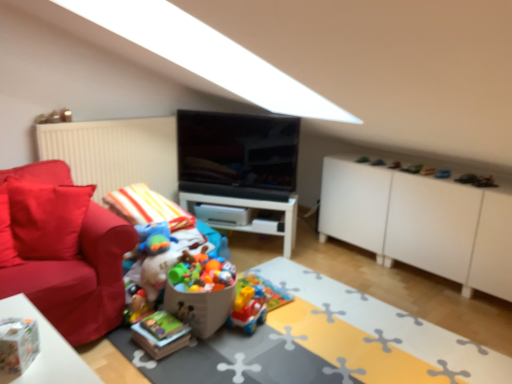
What is the approximate width of matte red couch at left?

It is 41.90 centimeters.

In order to face brightly colored plastic toys at center, the 2th toy positioned from the right, should I rotate leftwards or rightwards?

It's best to rotate left around 6.992 degrees.

What is the approximate width of white glossy table at center?

10.45 inches.

Where is `white glossy table at center`? Image resolution: width=512 pixels, height=384 pixels. white glossy table at center is located at coordinates (254, 208).

Where is `matte red couch at left`? matte red couch at left is located at coordinates (65, 251).

From the image's perspective, is white matte cabinet at right located above brightly colored plastic toys at center, the 2th toy positioned from the right?

Yes, from the image's perspective, white matte cabinet at right is over brightly colored plastic toys at center, the 2th toy positioned from the right.

Which object is positioned more to the left, white matte cabinet at right or brightly colored plastic toys at center, the 2th toy positioned from the right?

brightly colored plastic toys at center, the 2th toy positioned from the right, is more to the left.

In order to click on the 1st toy below the white matte cabinet at right (from the image's perspective) in this screenshot , I will do click(201, 308).

Does white glossy table at center contain black glossy tv at center?

No, white glossy table at center does not contain black glossy tv at center.

Is point (180, 198) positioned after point (279, 163)?

Yes, it is.

Considering the positions of objects white glossy table at center and black glossy tv at center in the image provided, who is behind, white glossy table at center or black glossy tv at center?

Positioned behind is white glossy table at center.

Which of these two, white glossy table at center or black glossy tv at center, is thinner?

black glossy tv at center.

Can you tell me how much matte red couch at left and plastic colorful toy car at center, positioned as the 2th toy in left-to-right order, differ in facing direction?

The angle between the facing direction of matte red couch at left and the facing direction of plastic colorful toy car at center, positioned as the 2th toy in left-to-right order, is 65.5 degrees.

Is matte red couch at left wider than plastic colorful toy car at center, positioned as the 2th toy in left-to-right order?

Correct, the width of matte red couch at left exceeds that of plastic colorful toy car at center, positioned as the 2th toy in left-to-right order.

Is matte red couch at left bigger than plastic colorful toy car at center, placed as the 1th toy when sorted from right to left?

Indeed, matte red couch at left has a larger size compared to plastic colorful toy car at center, placed as the 1th toy when sorted from right to left.

Is matte red couch at left inside or outside of plastic colorful toy car at center, placed as the 1th toy when sorted from right to left?

matte red couch at left cannot be found inside plastic colorful toy car at center, placed as the 1th toy when sorted from right to left.

Consider the image. Which is in front, black glossy tv at center or brightly colored plastic toys at center, the 2th toy positioned from the right?

brightly colored plastic toys at center, the 2th toy positioned from the right, is in front.

Is black glossy tv at center shorter than brightly colored plastic toys at center, the 2th toy positioned from the right?

In fact, black glossy tv at center may be taller than brightly colored plastic toys at center, the 2th toy positioned from the right.

Considering the relative sizes of black glossy tv at center and brightly colored plastic toys at center, the 2th toy positioned from the right, in the image provided, is black glossy tv at center thinner than brightly colored plastic toys at center, the 2th toy positioned from the right,?

Indeed, black glossy tv at center has a lesser width compared to brightly colored plastic toys at center, the 2th toy positioned from the right.

From the image's perspective, which one is positioned lower, black glossy tv at center or brightly colored plastic toys at center, which is the 1th toy in left-to-right order?

From the image's view, brightly colored plastic toys at center, which is the 1th toy in left-to-right order, is below.

Is point (240, 149) positioned behind point (8, 277)?

Yes, it is.

Based on the photo, how many degrees apart are the facing directions of black glossy tv at center and matte red couch at left?

There is a 14.2-degree angle between the facing directions of black glossy tv at center and matte red couch at left.

Identify the location of television behind the matte red couch at left. (237, 155).

Considering the sizes of objects brightly colored plastic toys at center, which is the 1th toy in left-to-right order, and plastic colorful toy car at center, placed as the 1th toy when sorted from right to left, in the image provided, who is thinner, brightly colored plastic toys at center, which is the 1th toy in left-to-right order, or plastic colorful toy car at center, placed as the 1th toy when sorted from right to left,?

Thinner between the two is plastic colorful toy car at center, placed as the 1th toy when sorted from right to left.

How many degrees apart are the facing directions of brightly colored plastic toys at center, the 2th toy positioned from the right, and plastic colorful toy car at center, positioned as the 2th toy in left-to-right order?

The angle between the facing direction of brightly colored plastic toys at center, the 2th toy positioned from the right, and the facing direction of plastic colorful toy car at center, positioned as the 2th toy in left-to-right order, is 3.53 degrees.

Identify the location of toy on the left side of plastic colorful toy car at center, positioned as the 2th toy in left-to-right order. (201, 308).

Is brightly colored plastic toys at center, which is the 1th toy in left-to-right order, positioned before plastic colorful toy car at center, placed as the 1th toy when sorted from right to left?

Yes, brightly colored plastic toys at center, which is the 1th toy in left-to-right order, is closer to the camera.

Looking at the image, does white glossy table at center seem bigger or smaller compared to white matte cabinet at right?

Clearly, white glossy table at center is smaller in size than white matte cabinet at right.

Are white glossy table at center and white matte cabinet at right making contact?

There is a gap between white glossy table at center and white matte cabinet at right.

Is white glossy table at center to the left or to the right of white matte cabinet at right in the image?

Based on their positions, white glossy table at center is located to the left of white matte cabinet at right.

Does white glossy table at center lie in front of white matte cabinet at right?

No, white glossy table at center is behind white matte cabinet at right.

I want to click on cabinetry located above the brightly colored plastic toys at center, which is the 1th toy in left-to-right order (from a real-world perspective), so click(421, 223).

Identify the location of table below the black glossy tv at center (from a real-world perspective). (254, 208).

When comparing their distances from plastic toy train at center, does plastic colorful toy car at center, placed as the 1th toy when sorted from right to left, or brightly colored plastic toys at center, the 2th toy positioned from the right, seem closer?

Among the two, plastic colorful toy car at center, placed as the 1th toy when sorted from right to left, is located nearer to plastic toy train at center.

When comparing their distances from brightly colored plastic toys at center, which is the 1th toy in left-to-right order, does white glossy table at center or plastic toy train at center seem closer?

plastic toy train at center lies closer to brightly colored plastic toys at center, which is the 1th toy in left-to-right order, than the other object.

Looking at the image, which one is located further to matte red couch at left, brightly colored plastic toys at center, the 2th toy positioned from the right, or white glossy table at center?

The object further to matte red couch at left is white glossy table at center.

Estimate the real-world distances between objects in this image. Which object is closer to white glossy table at center, plastic toy train at center or white matte cabinet at right?

white matte cabinet at right lies closer to white glossy table at center than the other object.

Considering their positions, is plastic toy train at center positioned closer to matte red couch at left than white matte cabinet at right?

Based on the image, plastic toy train at center appears to be nearer to matte red couch at left.

When comparing their distances from white glossy table at center, does brightly colored plastic toys at center, which is the 1th toy in left-to-right order, or matte red couch at left seem closer?

brightly colored plastic toys at center, which is the 1th toy in left-to-right order, is positioned closer to the anchor white glossy table at center.

Consider the image. From the image, which object appears to be farther from white matte cabinet at right, plastic colorful toy car at center, positioned as the 2th toy in left-to-right order, or black glossy tv at center?

plastic colorful toy car at center, positioned as the 2th toy in left-to-right order, is further to white matte cabinet at right.

From the image, which object appears to be nearer to plastic colorful toy car at center, positioned as the 2th toy in left-to-right order, white matte cabinet at right or black glossy tv at center?

black glossy tv at center.

In order to click on television between matte red couch at left and white glossy table at center along the z-axis in this screenshot , I will do `click(237, 155)`.

I want to click on toy between plastic toy train at center and plastic colorful toy car at center, positioned as the 2th toy in left-to-right order, from front to back, so click(x=201, y=308).

The height and width of the screenshot is (384, 512). I want to click on table between matte red couch at left and plastic colorful toy car at center, positioned as the 2th toy in left-to-right order, in the horizontal direction, so click(x=254, y=208).

In order to click on cabinetry between plastic toy train at center and white glossy table at center along the z-axis in this screenshot , I will do `click(421, 223)`.